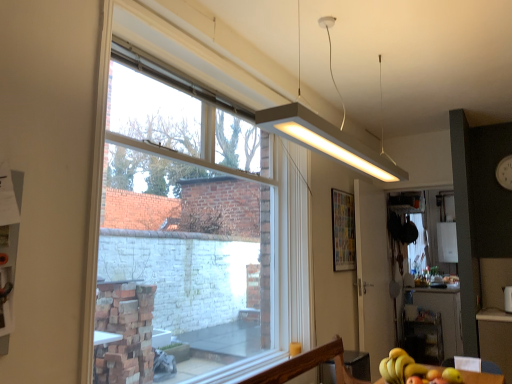
Identify the location of multicolored paper at upper right. (343, 230).

What do you see at coordinates (452, 376) in the screenshot?
I see `green matte apple at lower right` at bounding box center [452, 376].

The width and height of the screenshot is (512, 384). Describe the element at coordinates (496, 339) in the screenshot. I see `wooden table at lower right, the first table viewed from the right` at that location.

In order to click on white plastic clock at upper right in this screenshot , I will do `click(504, 172)`.

The width and height of the screenshot is (512, 384). In order to click on multicolored paper at upper right in this screenshot , I will do `click(343, 230)`.

From the picture: Is multicolored paper at upper right in front of or behind white plastic clock at upper right in the image?

In the image, multicolored paper at upper right appears in front of white plastic clock at upper right.

From a real-world perspective, is multicolored paper at upper right physically below white plastic clock at upper right?

Yes, from a real-world perspective, multicolored paper at upper right is beneath white plastic clock at upper right.

Considering the relative sizes of multicolored paper at upper right and white plastic clock at upper right in the image provided, is multicolored paper at upper right smaller than white plastic clock at upper right?

Indeed, multicolored paper at upper right has a smaller size compared to white plastic clock at upper right.

Is white glossy screen door at center oriented away from clear glass window at center?

white glossy screen door at center is not turned away from clear glass window at center.

From a real-world perspective, which is physically below, white glossy screen door at center or clear glass window at center?

From a 3D spatial view, white glossy screen door at center is below.

Which object is positioned more to the left, white glossy screen door at center or clear glass window at center?

clear glass window at center.

Does white glossy screen door at center have a lesser width compared to yellow matte bananas at lower right?

Yes, white glossy screen door at center is thinner than yellow matte bananas at lower right.

In the scene shown: Does white glossy screen door at center have a smaller size compared to yellow matte bananas at lower right?

No.

From a real-world perspective, which object stands above the other?

In real-world perspective, white glossy screen door at center is above.

Can you confirm if white matte rectangular light fixture at upper center is thinner than clear glass window at center?

In fact, white matte rectangular light fixture at upper center might be wider than clear glass window at center.

How many degrees apart are the facing directions of white matte rectangular light fixture at upper center and clear glass window at center?

There is a 90.4-degree angle between the facing directions of white matte rectangular light fixture at upper center and clear glass window at center.

Which is in front, point (281, 113) or point (109, 379)?

The point (281, 113) is closer to the camera.

Is white matte rectangular light fixture at upper center not near clear glass window at center?

That's right, there is a large distance between white matte rectangular light fixture at upper center and clear glass window at center.

Is white plastic clock at upper right positioned beyond the bounds of wooden table at lower right, placed as the first table when sorted from front to back?

Indeed, white plastic clock at upper right is completely outside wooden table at lower right, placed as the first table when sorted from front to back.

Considering the relative positions of white plastic clock at upper right and wooden table at lower right, acting as the 2th table starting from the right, in the image provided, is white plastic clock at upper right in front of wooden table at lower right, acting as the 2th table starting from the right,?

No, it is not.

Is white plastic clock at upper right oriented towards wooden table at lower right, the 1th table viewed from the left?

Yes, white plastic clock at upper right faces towards wooden table at lower right, the 1th table viewed from the left.

Is wooden table at lower right, which appears as the first table when viewed from the top, touching yellow matte bananas at lower right?

No, wooden table at lower right, which appears as the first table when viewed from the top, is not touching yellow matte bananas at lower right.

Considering the relative positions of wooden table at lower right, acting as the 2th table starting from the right, and yellow matte bananas at lower right in the image provided, is wooden table at lower right, acting as the 2th table starting from the right, in front of yellow matte bananas at lower right?

Yes, wooden table at lower right, acting as the 2th table starting from the right, is in front of yellow matte bananas at lower right.

Identify the location of banana above the wooden table at lower right, placed as the first table when sorted from front to back (from the image's perspective). (400, 367).

Considering the relative sizes of wooden table at lower right, which ranks as the 2th table in bottom-to-top order, and yellow matte bananas at lower right in the image provided, is wooden table at lower right, which ranks as the 2th table in bottom-to-top order, thinner than yellow matte bananas at lower right?

Incorrect, the width of wooden table at lower right, which ranks as the 2th table in bottom-to-top order, is not less than that of yellow matte bananas at lower right.

Is point (452, 378) closer or farther from the camera than point (360, 145)?

Point (452, 378) is positioned closer to the camera compared to point (360, 145).

Considering the sizes of green matte apple at lower right and white matte rectangular light fixture at upper center in the image, is green matte apple at lower right wider or thinner than white matte rectangular light fixture at upper center?

green matte apple at lower right is thinner than white matte rectangular light fixture at upper center.

Is green matte apple at lower right outside of white matte rectangular light fixture at upper center?

Yes, green matte apple at lower right is outside of white matte rectangular light fixture at upper center.

At what (x,y) coordinates should I click in order to perform the action: click on bulletin board that is in front of the white plastic clock at upper right. Please return your answer as a coordinate pair (x, y). Looking at the image, I should click on (343, 230).

This screenshot has width=512, height=384. In order to click on window above the white glossy screen door at center (from a real-world perspective) in this screenshot , I will do `click(193, 233)`.

Which object lies nearer to the anchor point yellow matte bananas at lower right, wooden table at lower right, which appears as the first table when viewed from the top, or clear glass window at center?

wooden table at lower right, which appears as the first table when viewed from the top, is closer to yellow matte bananas at lower right.

Based on their spatial positions, is white matte rectangular light fixture at upper center or green matte apple at lower right further from clear glass window at center?

green matte apple at lower right is positioned further to the anchor clear glass window at center.

Which object lies nearer to the anchor point green matte apple at lower right, wooden table at lower right, which ranks as the 2th table in bottom-to-top order, or yellow matte bananas at lower right?

wooden table at lower right, which ranks as the 2th table in bottom-to-top order, is positioned closer to the anchor green matte apple at lower right.

Estimate the real-world distances between objects in this image. Which object is further from wooden table at lower right, acting as the 2th table starting from the right, wooden table at lower right, which is the second table in front-to-back order, or green matte apple at lower right?

wooden table at lower right, which is the second table in front-to-back order, is positioned further to the anchor wooden table at lower right, acting as the 2th table starting from the right.

Based on their spatial positions, is green matte apple at lower right or clear glass window at center further from white plastic clock at upper right?

Based on the image, clear glass window at center appears to be further to white plastic clock at upper right.

In the scene shown: Based on their spatial positions, is yellow matte bananas at lower right or white matte rectangular light fixture at upper center further from wooden table at lower right, the 1th table viewed from the left?

white matte rectangular light fixture at upper center is positioned further to the anchor wooden table at lower right, the 1th table viewed from the left.

Which object lies nearer to the anchor point multicolored paper at upper right, green matte apple at lower right or wooden table at lower right, acting as the 2th table starting from the right?

The object closer to multicolored paper at upper right is wooden table at lower right, acting as the 2th table starting from the right.

Considering their positions, is white glossy screen door at center positioned further to multicolored paper at upper right than wooden table at lower right, the first table in the back-to-front sequence?

wooden table at lower right, the first table in the back-to-front sequence.

Locate an element on the screen. This screenshot has height=384, width=512. banana positioned between wooden table at lower right, the 1th table viewed from the left, and white glossy screen door at center from near to far is located at coordinates (400, 367).

This screenshot has height=384, width=512. Find the location of `bulletin board between yellow matte bananas at lower right and white glossy screen door at center along the z-axis`. bulletin board between yellow matte bananas at lower right and white glossy screen door at center along the z-axis is located at coordinates (343, 230).

Locate an element on the screen. bulletin board positioned between clear glass window at center and white glossy screen door at center from near to far is located at coordinates (343, 230).

Where is `screen door between clear glass window at center and white plastic clock at upper right from left to right`? screen door between clear glass window at center and white plastic clock at upper right from left to right is located at coordinates (373, 275).